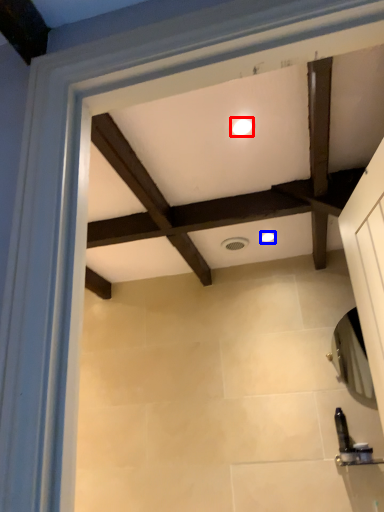
Question: Which of the following is the closest to the observer, lighting (highlighted by a red box) or lighting (highlighted by a blue box)?

Choices:
 (A) lighting
 (B) lighting

Answer: (A)